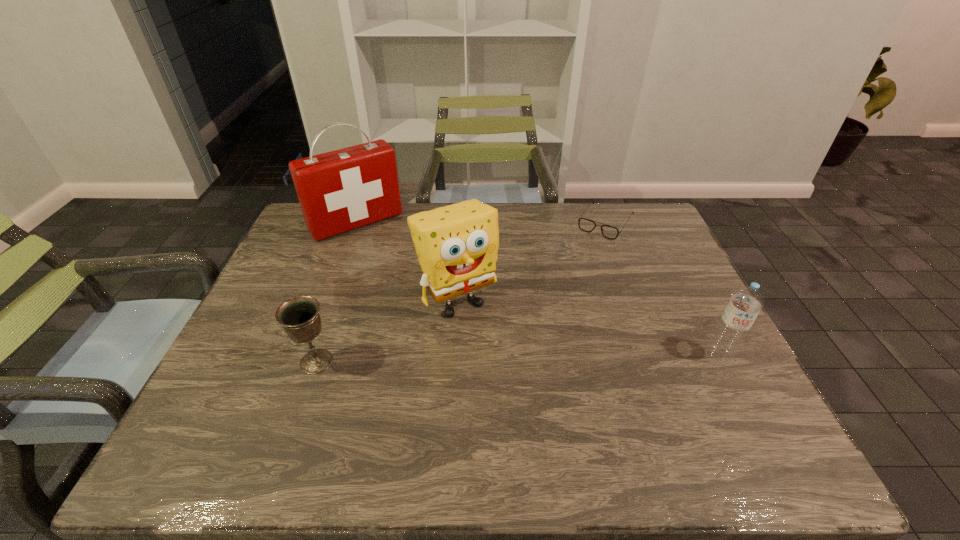
Locate an element on the screen. This screenshot has height=540, width=960. vacant space on the desktop that is between the second shortest object and the third shortest object and is positioned on the face of the third object from right to left is located at coordinates (498, 359).

This screenshot has height=540, width=960. Find the location of `free spot on the desktop that is between the chalice and the rightmost object and is positioned on the front-facing side of the fourth object from left to right`. free spot on the desktop that is between the chalice and the rightmost object and is positioned on the front-facing side of the fourth object from left to right is located at coordinates (514, 359).

Find the location of a particular element. This screenshot has height=540, width=960. free space on the desktop that is between the chalice and the third tallest object and is positioned on the front face of the tallest object is located at coordinates (462, 360).